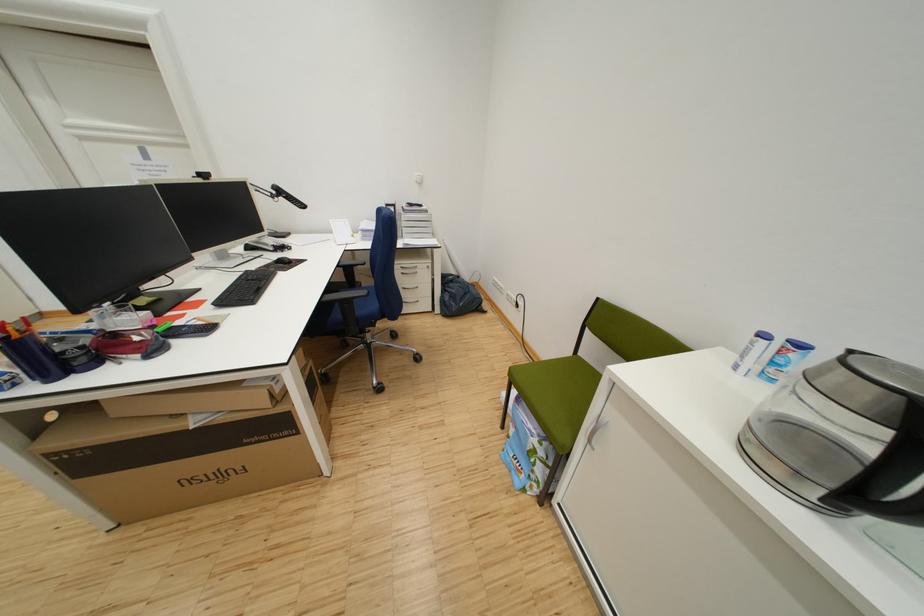
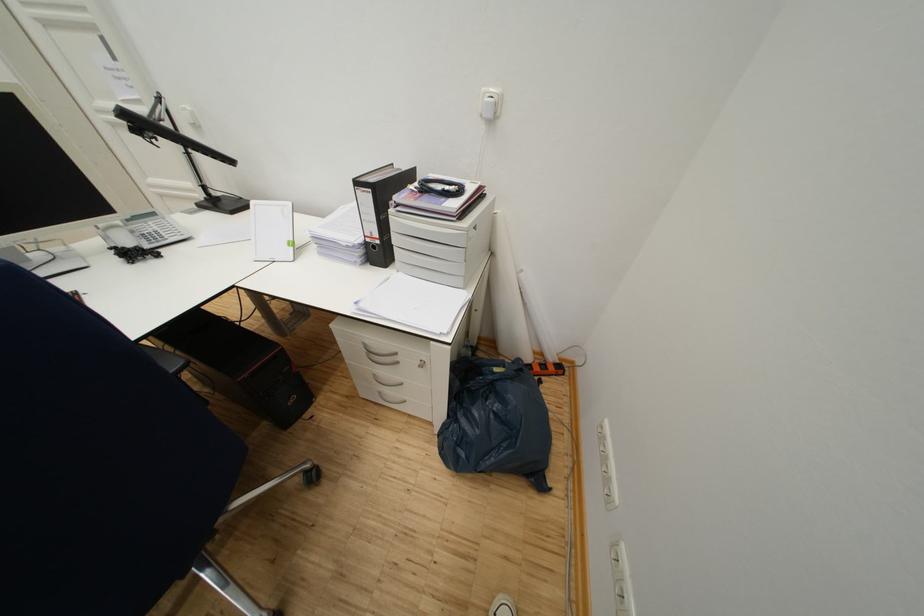
Locate, in the second image, the point that corresponds to (x=457, y=293) in the first image.

(468, 423)